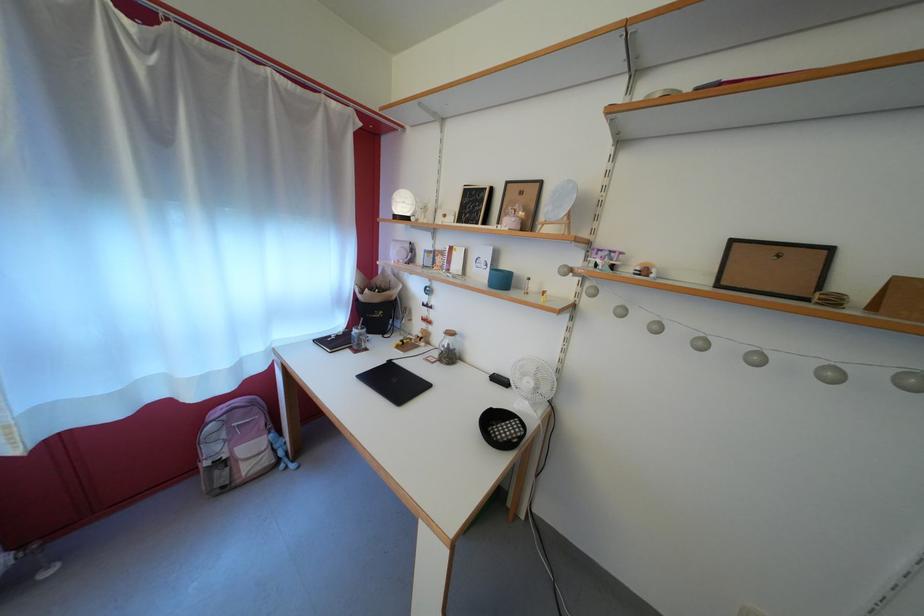
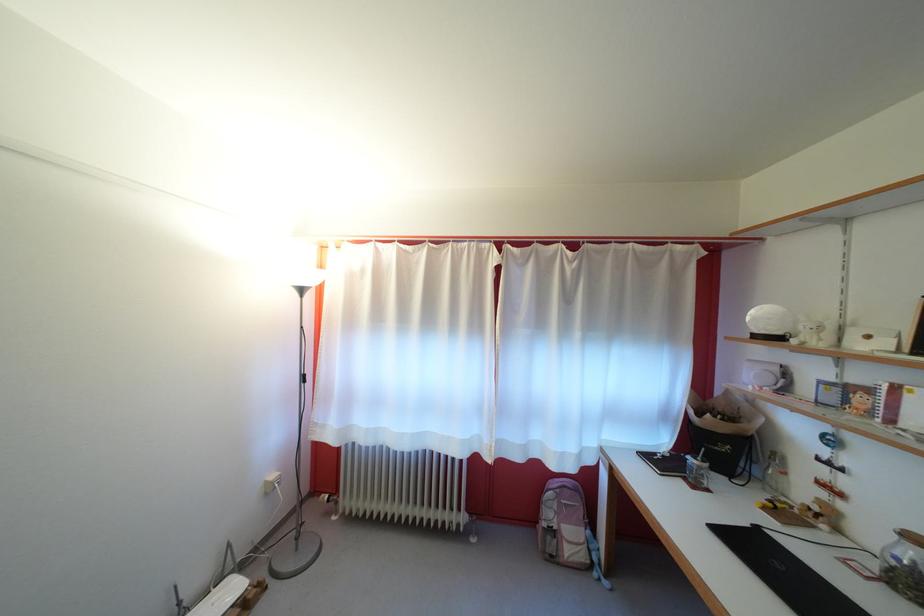
The point at (368, 341) is marked in the first image. Where is the corresponding point in the second image?

(708, 474)